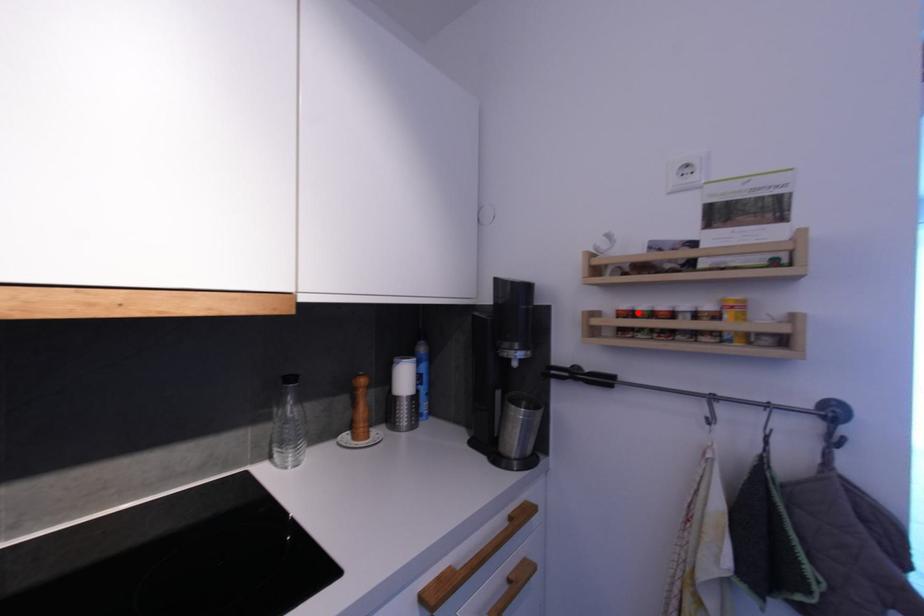
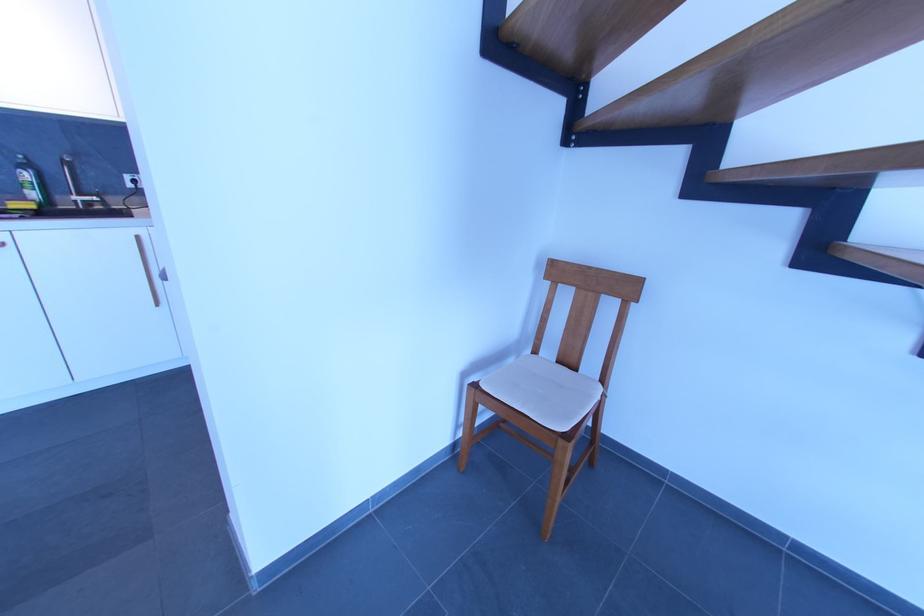
Question: I am providing you with two images of the same scene from different viewpoints. A red point is marked on the first image. Can you still see the location of the red point in image 2?

Choices:
 (A) Yes
 (B) No

Answer: (B)